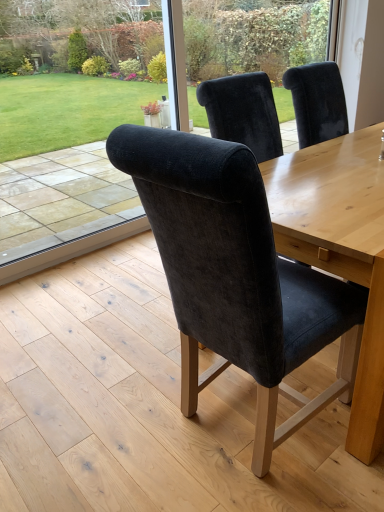
Question: Is velvet chair back at center wider or thinner than transparent glass door at upper center?

Choices:
 (A) thin
 (B) wide

Answer: (B)

Question: Do you think velvet chair back at center is within transparent glass door at upper center, or outside of it?

Choices:
 (A) outside
 (B) inside

Answer: (A)

Question: Estimate the real-world distances between objects in this image. Which object is farther from the transparent glass door at upper center?

Choices:
 (A) velvet chair back at center
 (B) velvet dark blue chair at center

Answer: (B)

Question: Which object is positioned farthest from the velvet chair back at center?

Choices:
 (A) transparent glass door at upper center
 (B) velvet dark blue chair at center

Answer: (B)